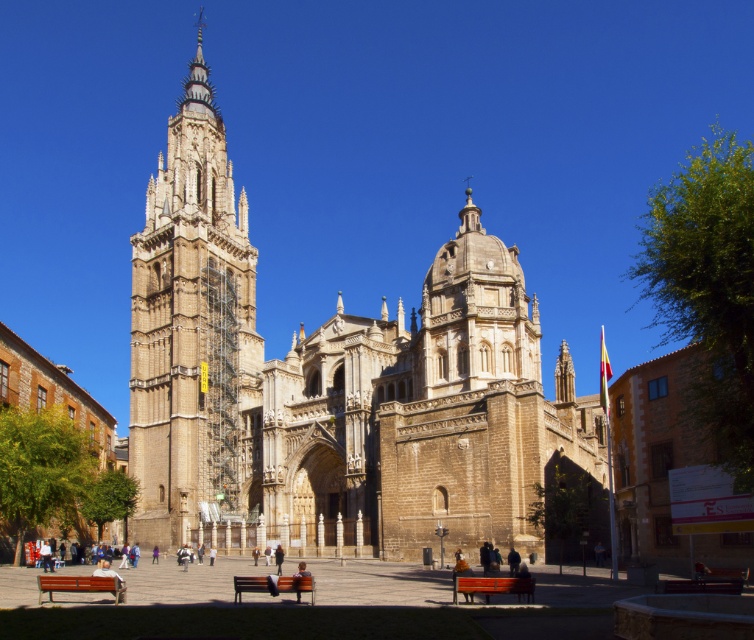
Can you confirm if brown stone church at center is wider than wooden bench at lower right?

Yes.

Is brown stone church at center further to camera compared to wooden bench at lower right?

Yes, brown stone church at center is further from the viewer.

This screenshot has height=640, width=754. Identify the location of brown stone church at center. point(333,387).

Who is taller, wooden bench at lower left or light brown leather jacket at center?

With more height is light brown leather jacket at center.

Who is more forward, (121, 596) or (293, 573)?

Point (121, 596) is in front.

This screenshot has width=754, height=640. What do you see at coordinates (78, 586) in the screenshot?
I see `wooden bench at lower left` at bounding box center [78, 586].

You are a GUI agent. You are given a task and a screenshot of the screen. Output one action in this format:
    pyautogui.click(x=<x>, y=<y>)
    Task: Click on the wooden bench at lower left
    This screenshot has width=754, height=640.
    Given the screenshot: What is the action you would take?
    point(78,586)

Between point (572, 435) and point (523, 577), which one is positioned behind?

Point (572, 435)

What do you see at coordinates (333, 387) in the screenshot?
I see `brown stone church at center` at bounding box center [333, 387].

Where is `brown stone church at center`? This screenshot has height=640, width=754. brown stone church at center is located at coordinates (333, 387).